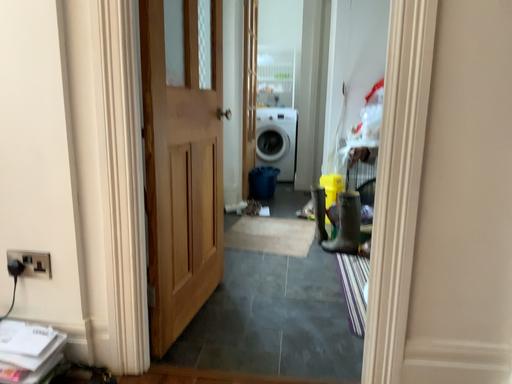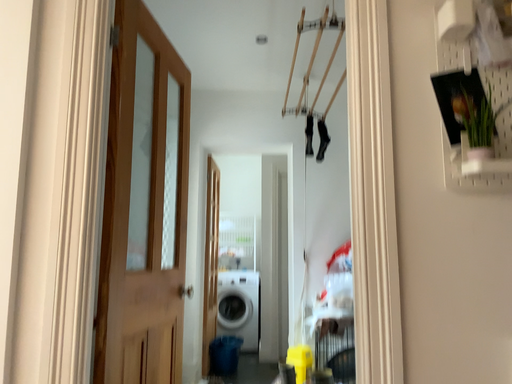
Question: Which way did the camera rotate in the video?

Choices:
 (A) rotated upward
 (B) rotated downward

Answer: (A)